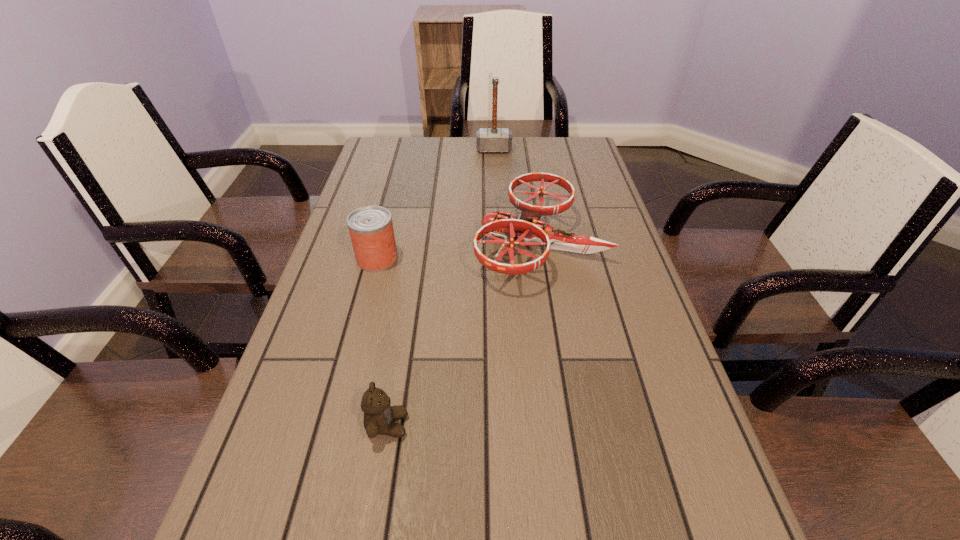
Where is `vacant space located 0.140m on the back of the drone`? Image resolution: width=960 pixels, height=540 pixels. vacant space located 0.140m on the back of the drone is located at coordinates (529, 176).

The image size is (960, 540). I want to click on object at the far edge, so click(494, 139).

This screenshot has height=540, width=960. I want to click on object positioned at the left edge, so click(371, 231).

Locate an element on the screen. The image size is (960, 540). object that is at the right edge is located at coordinates (529, 228).

Where is `vacant space at the far edge of the desktop`? The image size is (960, 540). vacant space at the far edge of the desktop is located at coordinates (450, 153).

The image size is (960, 540). In the image, there is a desktop. In order to click on free space at the left edge in this screenshot , I will do `click(248, 491)`.

Where is `vacant area at the right edge of the desktop`? This screenshot has width=960, height=540. vacant area at the right edge of the desktop is located at coordinates (618, 260).

This screenshot has width=960, height=540. I want to click on vacant space at the far right corner, so (x=545, y=137).

Where is `free space between the second object from left to right and the drone`? free space between the second object from left to right and the drone is located at coordinates (464, 334).

Locate an element on the screen. free space between the drone and the nearest object is located at coordinates (464, 334).